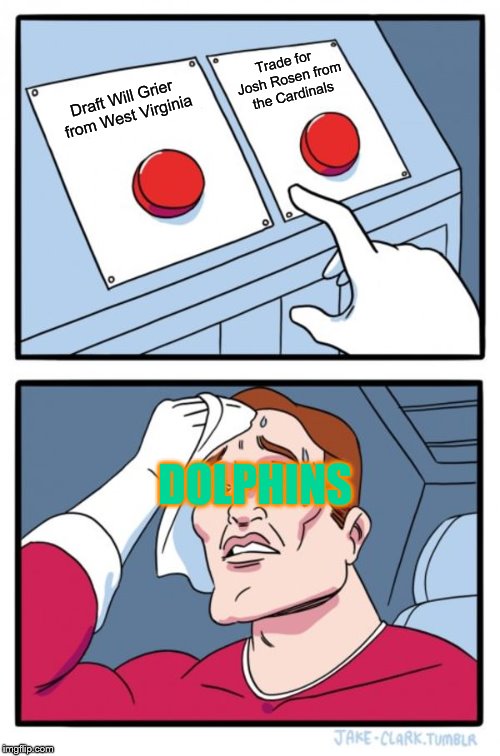
This screenshot has height=756, width=500. Find the location of `panels`. panels is located at coordinates (444, 225), (415, 657).